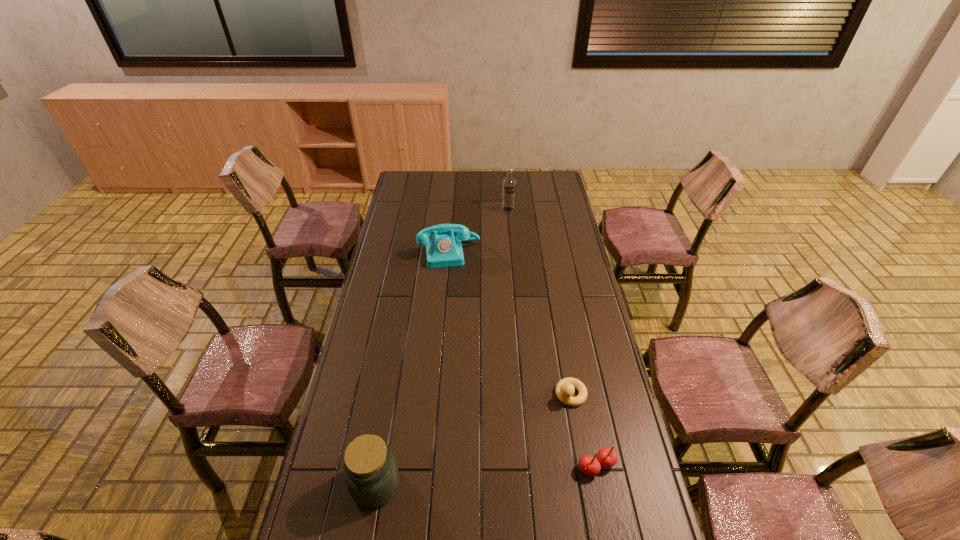
Locate an element on the screen. free space located 0.260m on the dial of the fourth nearest object is located at coordinates (459, 312).

Where is `free space located 0.120m on the dial of the fourth nearest object`? The height and width of the screenshot is (540, 960). free space located 0.120m on the dial of the fourth nearest object is located at coordinates (455, 287).

Where is `free space located on the front label of the tallest object`? free space located on the front label of the tallest object is located at coordinates (508, 226).

At what (x,y) coordinates should I click in order to perform the action: click on free space located 0.210m on the front label of the tallest object. Please return your answer as a coordinate pair (x, y). This screenshot has width=960, height=540. Looking at the image, I should click on (509, 240).

Where is `vacant area situated on the front label of the tallest object`? vacant area situated on the front label of the tallest object is located at coordinates (509, 238).

The height and width of the screenshot is (540, 960). I want to click on free space located at the beak of the third nearest object, so click(x=484, y=491).

What are the coordinates of `vacant space situated 0.400m at the beak of the third nearest object` in the screenshot? It's located at (476, 500).

The height and width of the screenshot is (540, 960). In order to click on free space located at the beak of the third nearest object in this screenshot , I will do `click(542, 425)`.

Find the location of a particular element. object that is at the near edge is located at coordinates (371, 474).

This screenshot has width=960, height=540. I want to click on object situated at the left edge, so click(x=371, y=474).